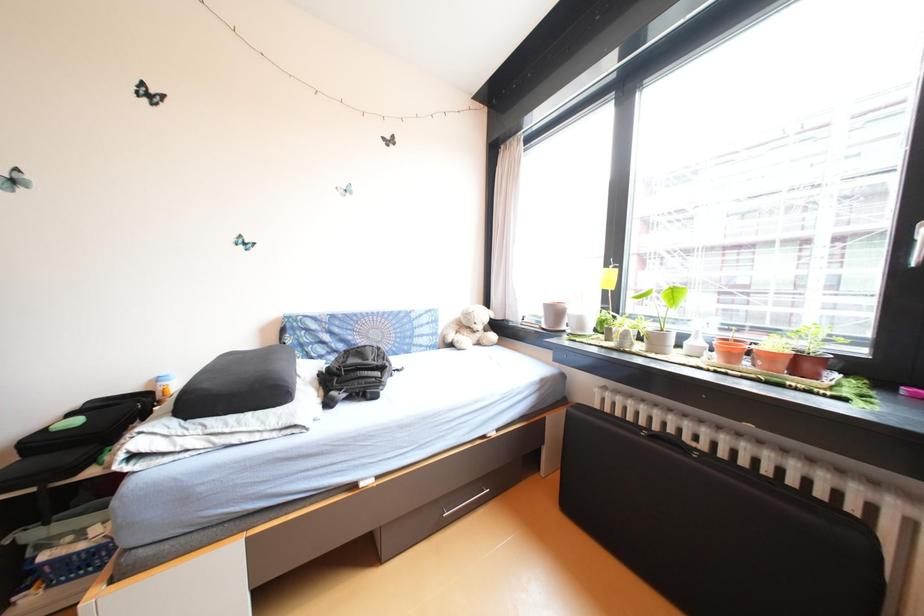
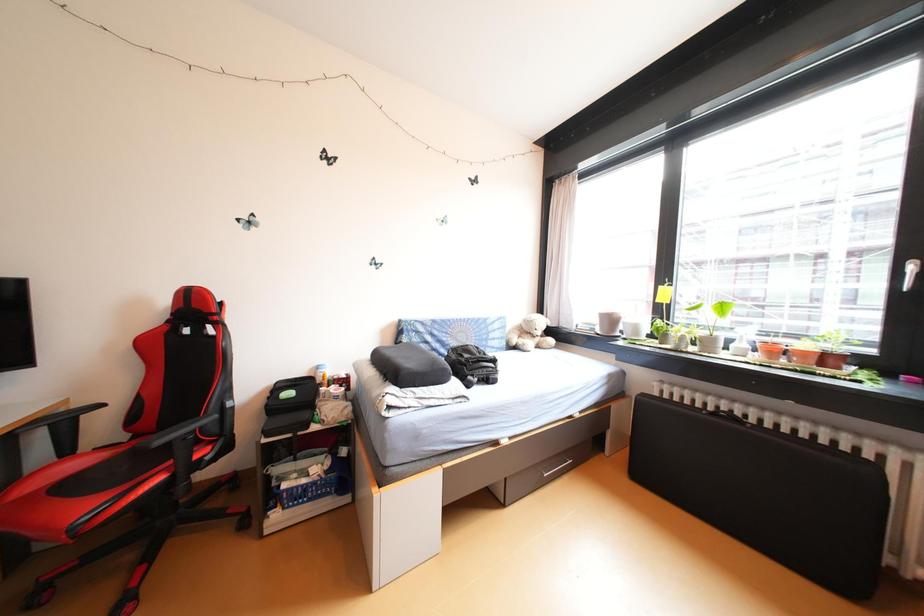
The images are taken continuously from a first-person perspective. In which direction are you moving?

The movement direction of the cameraman is left, backward.